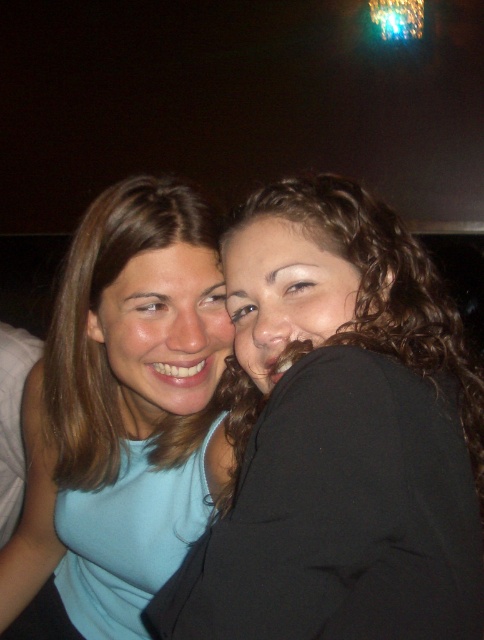
You are holding a 12 inch long ruler and want to measure the distance from the camera to the point at coordinates point (265, 477). Can you determine if the ruler can reach that point?

The distance of point (265, 477) from camera is 19.89 inches. Since the ruler is only 12 inches long, it cannot reach the point.

You are standing in front of the image and want to locate the matte black jacket at center. According to the coordinates provided, where exactly is it positioned?

The matte black jacket at center is located at point 0.681 on the x axis and 0.698 on the y axis.